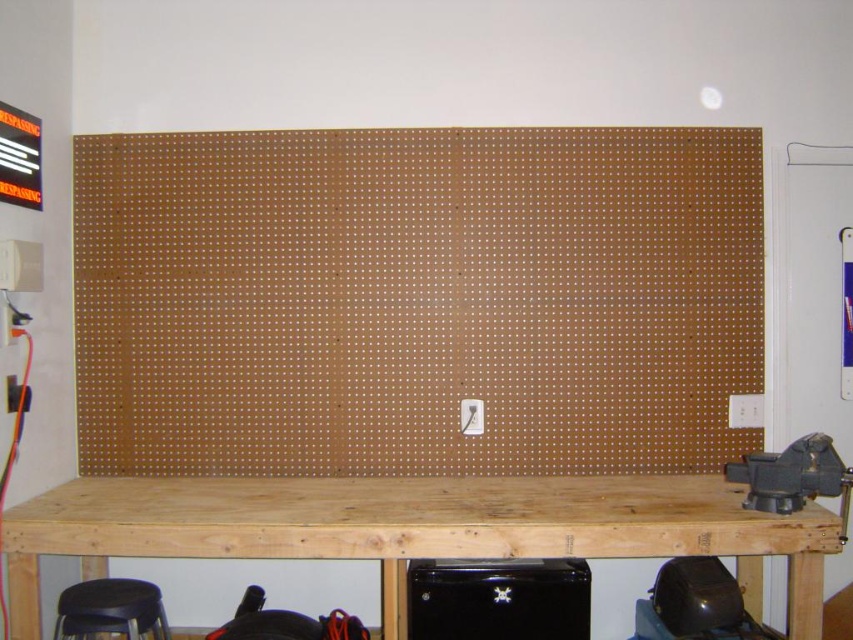
Based on the photo, between natural wood table at center and black matte stool at lower left, which one is positioned lower?

black matte stool at lower left

Who is more forward, (509, 552) or (102, 612)?

Point (509, 552)

I want to click on natural wood table at center, so click(x=415, y=529).

In the scene shown: Who is higher up, brown pegboard at center or natural wood table at center?

brown pegboard at center is higher up.

Which is more to the left, brown pegboard at center or natural wood table at center?

natural wood table at center is more to the left.

Is point (129, 355) farther from viewer compared to point (38, 509)?

Yes, it is.

Where is `brown pegboard at center`? The image size is (853, 640). brown pegboard at center is located at coordinates (415, 300).

Is brown pegboard at center closer to the viewer compared to black matte stool at lower left?

No.

Is point (637, 378) farther from viewer compared to point (90, 611)?

Yes.

You are a GUI agent. You are given a task and a screenshot of the screen. Output one action in this format:
    pyautogui.click(x=<x>, y=<y>)
    Task: Click on the brown pegboard at center
    
    Given the screenshot: What is the action you would take?
    coord(415,300)